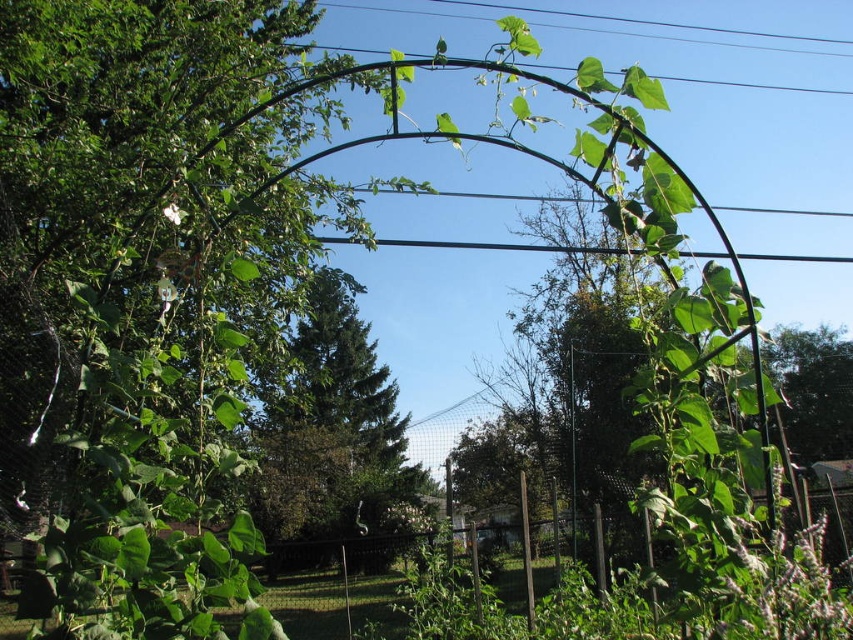
Between green matte trellis at center and green leafy tree at center, which one is positioned higher?

green matte trellis at center

Can you confirm if green matte trellis at center is positioned below green leafy tree at center?

Actually, green matte trellis at center is above green leafy tree at center.

Which is behind, point (126, 237) or point (299, 524)?

The point (299, 524) is more distant.

Locate an element on the screen. green matte trellis at center is located at coordinates (170, 307).